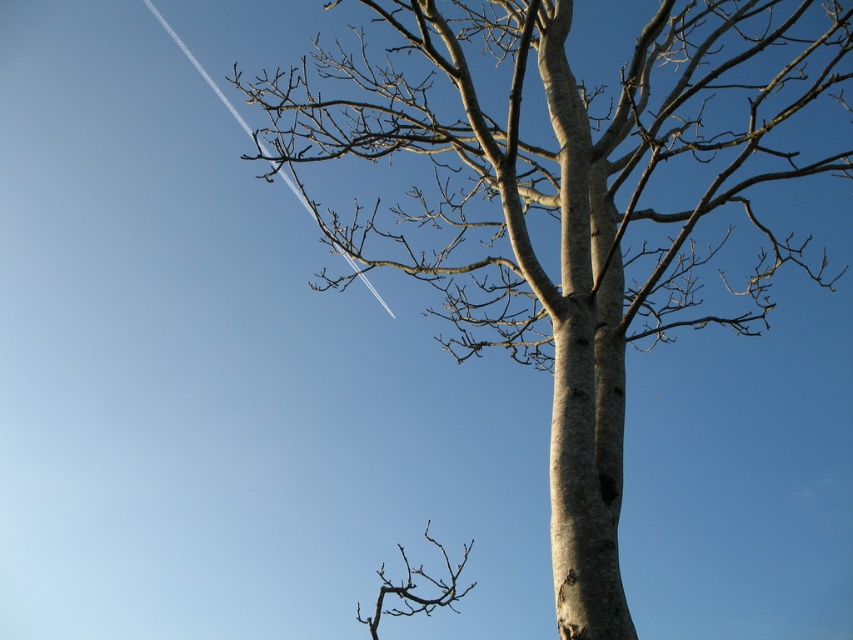
In order to click on smooth bark tree at center in this screenshot , I will do `click(564, 211)`.

Is smooth bark tree at center positioned in front of brown rough branch at lower center?

That is True.

I want to click on smooth bark tree at center, so click(564, 211).